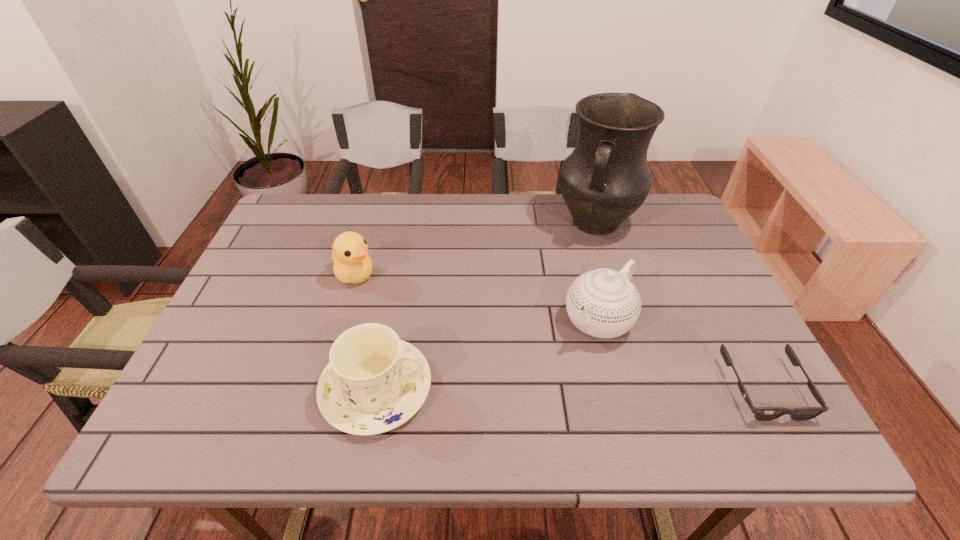
Find the location of a particular element. The width and height of the screenshot is (960, 540). free location that satisfies the following two spatial constraints: 1. on the back side of the farthest object; 2. on the left side of the right chinaware is located at coordinates (573, 222).

Locate an element on the screen. The image size is (960, 540). vacant space that satisfies the following two spatial constraints: 1. on the front side of the duck; 2. on the handle side of the shorter chinaware is located at coordinates (322, 388).

The width and height of the screenshot is (960, 540). Identify the location of vacant space that satisfies the following two spatial constraints: 1. on the back side of the tallest object; 2. on the left side of the second farthest object. [x=371, y=222].

Find the location of `free space that satisfies the following two spatial constraints: 1. on the back side of the tallest object; 2. on the left side of the taller chinaware`. free space that satisfies the following two spatial constraints: 1. on the back side of the tallest object; 2. on the left side of the taller chinaware is located at coordinates (573, 222).